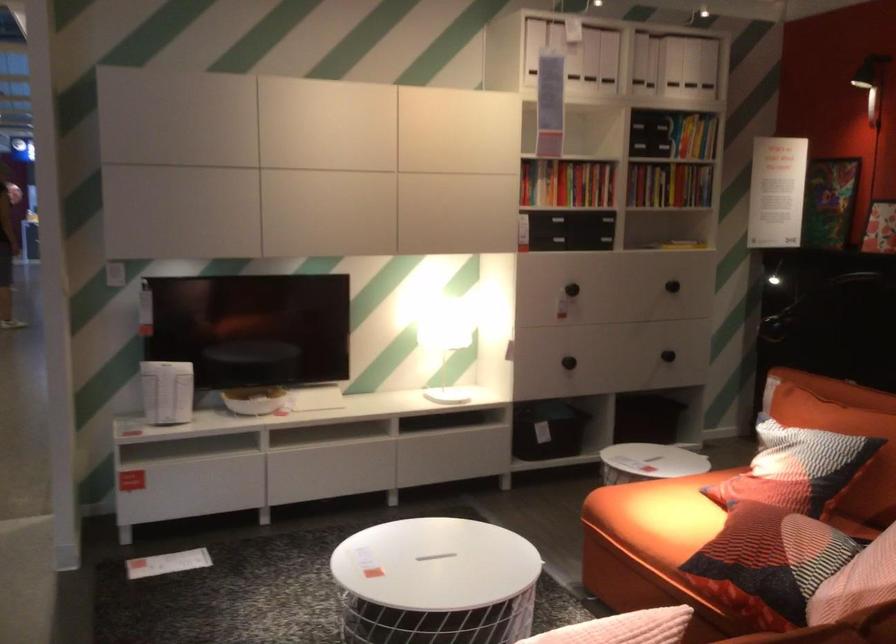
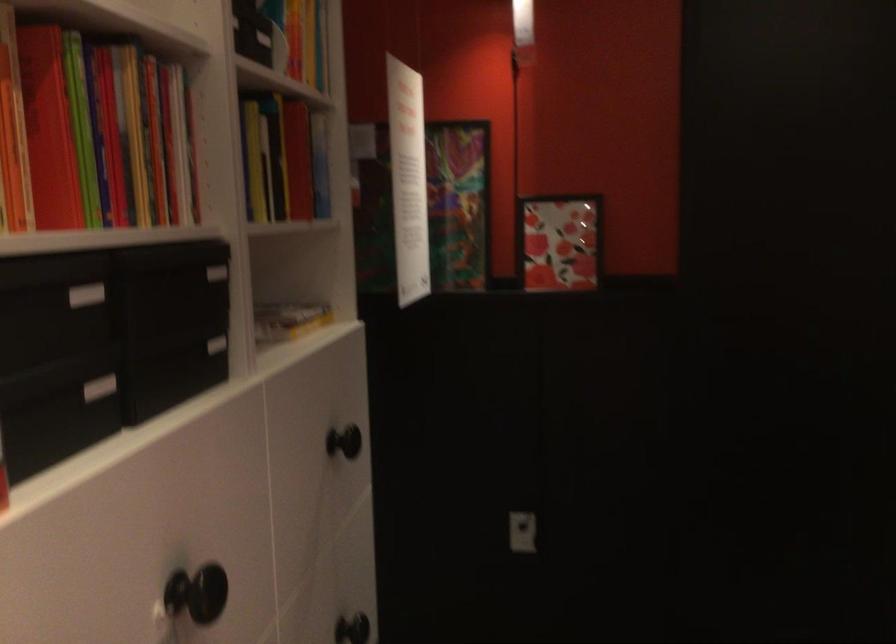
The point at (572,214) is marked in the first image. Where is the corresponding point in the second image?

(99, 388)